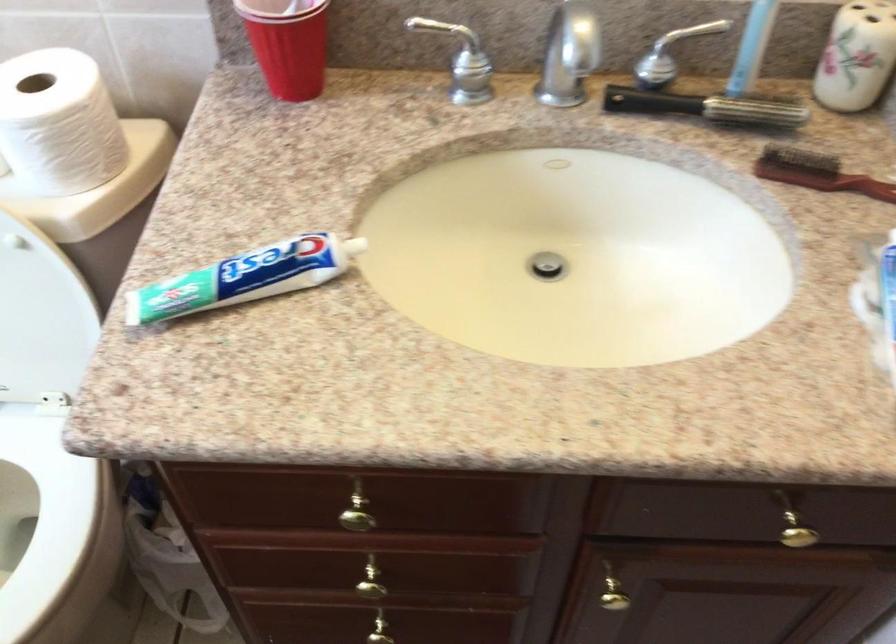
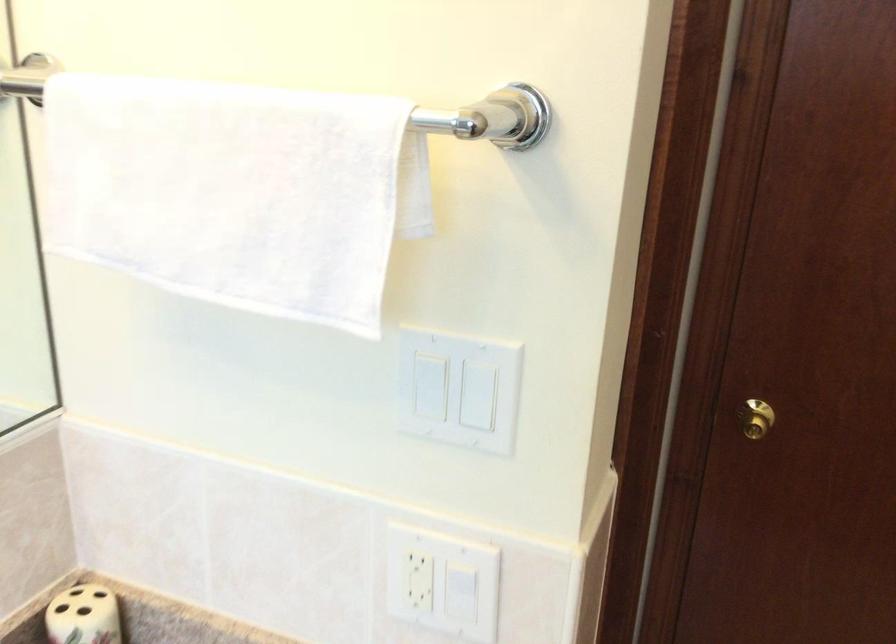
Question: The camera is either moving clockwise (left) or counter-clockwise (right) around the object. The first image is from the beginning of the video and the second image is from the end. Is the camera moving left or right when shooting the video?

Choices:
 (A) Left
 (B) Right

Answer: (A)